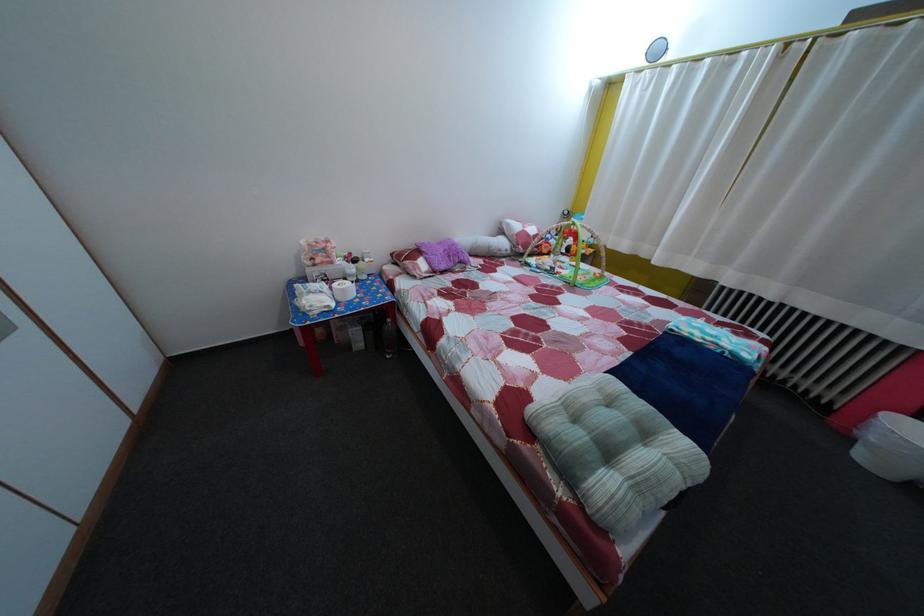
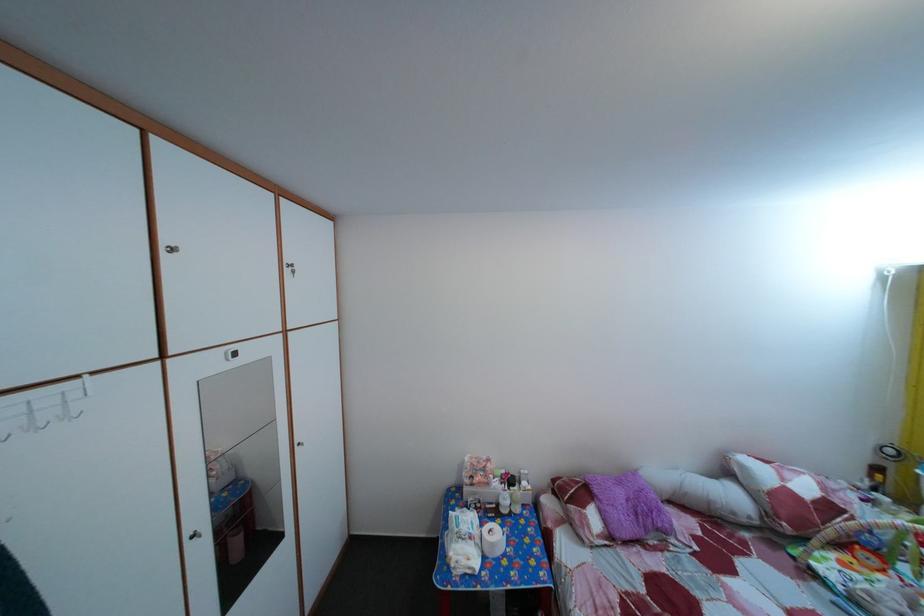
Where in the second image is the point corresponding to (x=367, y=265) from the first image?

(524, 485)